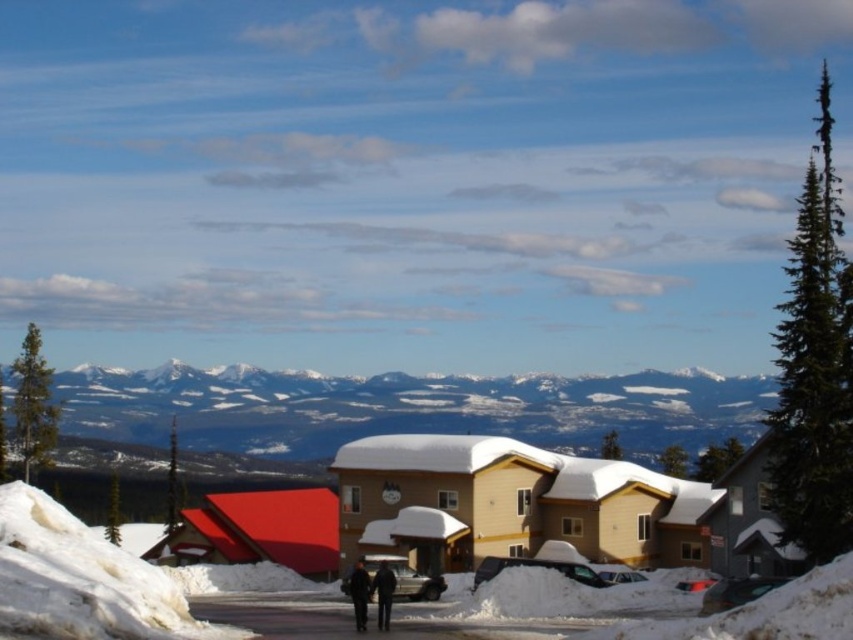
Question: Is smooth snow ski slope at lower left to the right of dark blue jeans at center from the viewer's perspective?

Choices:
 (A) no
 (B) yes

Answer: (A)

Question: Which of the following is the closest to the observer?

Choices:
 (A) (354, 520)
 (B) (10, 372)

Answer: (A)

Question: Does smooth snow ski slope at lower left appear on the right side of green matte pine at left?

Choices:
 (A) yes
 (B) no

Answer: (A)

Question: Does green textured pine at right have a larger size compared to dark blue jeans at center?

Choices:
 (A) yes
 (B) no

Answer: (A)

Question: Which is nearer to the beige wood ski resort at center?

Choices:
 (A) black fabric jacket at center
 (B) snow-covered mountain at upper center
 (C) smooth snow ski slope at lower left
 (D) green matte pine at left

Answer: (A)

Question: Which point is closer to the camera?

Choices:
 (A) snow-covered mountain at upper center
 (B) beige wood ski resort at center
 (C) green matte pine at left

Answer: (B)